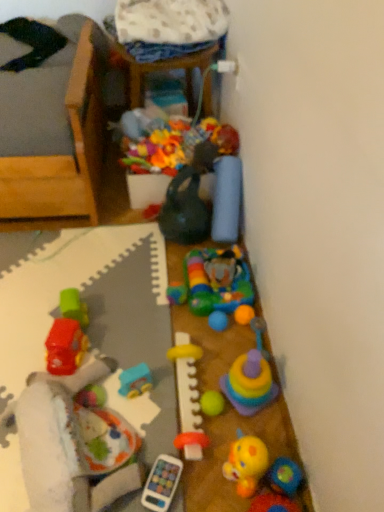
Identify the location of vacant space behind green rubber ball at center, which is counted as the 7th toy, starting from the right. (204, 353).